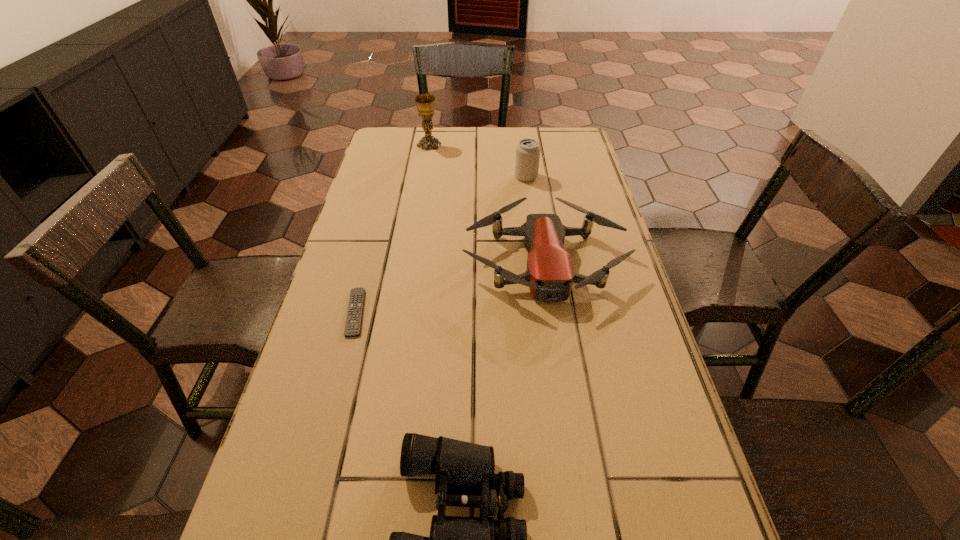
The height and width of the screenshot is (540, 960). Find the location of `the farthest object`. the farthest object is located at coordinates (425, 103).

Where is `the fourth object from right to left`? Image resolution: width=960 pixels, height=540 pixels. the fourth object from right to left is located at coordinates (425, 103).

The width and height of the screenshot is (960, 540). I want to click on the fourth shortest object, so click(x=528, y=150).

You are a GUI agent. You are given a task and a screenshot of the screen. Output one action in this format:
    pyautogui.click(x=<x>, y=<y>)
    Task: Click on the second farthest object
    The width and height of the screenshot is (960, 540).
    Given the screenshot: What is the action you would take?
    pyautogui.click(x=528, y=150)

Where is `drone`? The image size is (960, 540). drone is located at coordinates (550, 274).

Where is `remote control`? This screenshot has width=960, height=540. remote control is located at coordinates (353, 324).

Where is `the shortest object`? Image resolution: width=960 pixels, height=540 pixels. the shortest object is located at coordinates (353, 324).

Locate an element on the screen. The height and width of the screenshot is (540, 960). vacant space situated 0.380m on the right of the chalice is located at coordinates (546, 145).

Locate an element on the screen. This screenshot has width=960, height=540. free location located 0.210m on the left of the can is located at coordinates (451, 177).

The image size is (960, 540). Find the location of `vacant space located 0.050m on the front-facing side of the drone`. vacant space located 0.050m on the front-facing side of the drone is located at coordinates (555, 328).